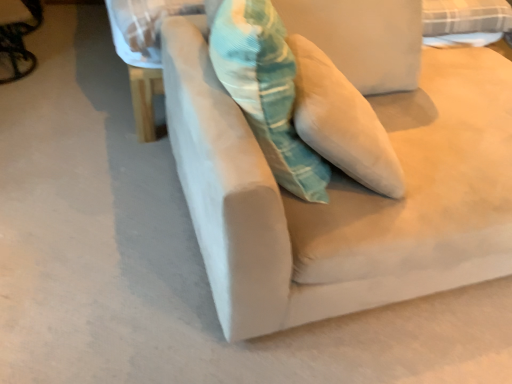
Locate an element on the screen. The width and height of the screenshot is (512, 384). vacant area that is situated to the right of metallic silver swivel chair at left is located at coordinates coord(71,74).